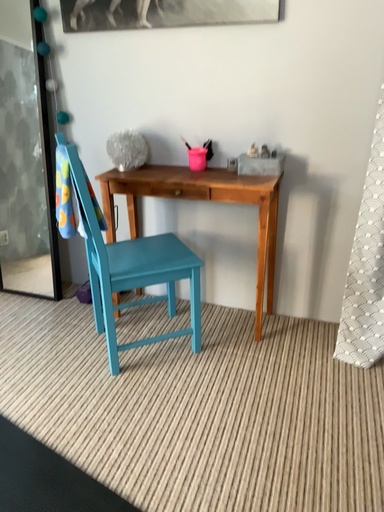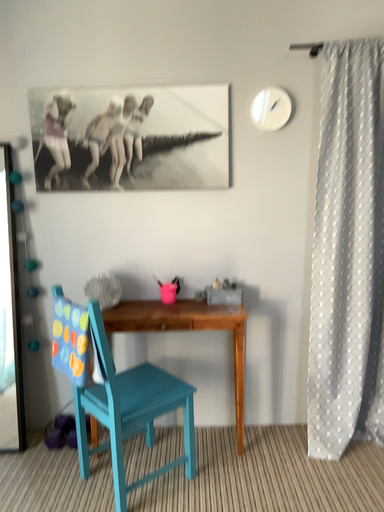
Question: Which way did the camera rotate in the video?

Choices:
 (A) rotated right
 (B) rotated left

Answer: (A)